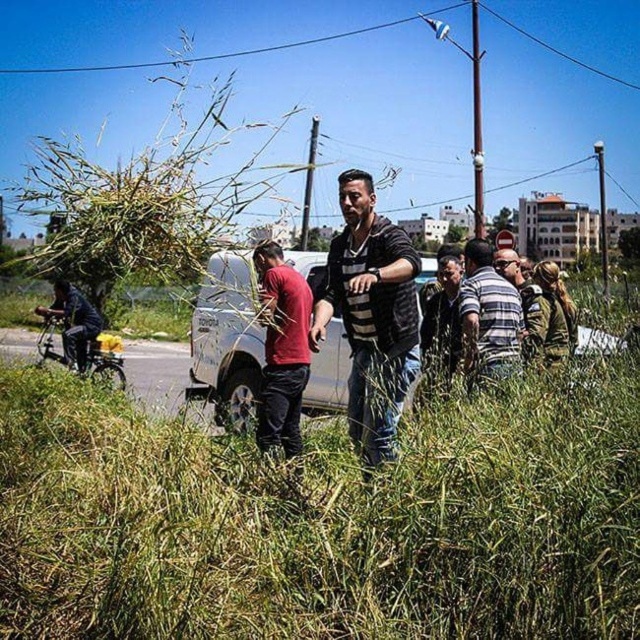
Question: Considering the real-world distances, which object is farthest from the striped sweater at center?

Choices:
 (A) striped fabric shirt at center
 (B) dark gray fabric bicycle at left
 (C) green grass at center
 (D) dark gray striped shirt at center

Answer: (B)

Question: Can you confirm if striped fabric shirt at center is positioned to the right of dark gray striped shirt at center?

Choices:
 (A) no
 (B) yes

Answer: (B)

Question: From the image, what is the correct spatial relationship of striped sweater at center in relation to dark gray fabric bicycle at left?

Choices:
 (A) left
 (B) right

Answer: (B)

Question: Which point is closer to the camera?

Choices:
 (A) (611, 385)
 (B) (429, 364)
 (C) (292, 426)

Answer: (A)

Question: Is green grass at center further to camera compared to white matte van at center?

Choices:
 (A) no
 (B) yes

Answer: (A)

Question: Which of these objects is positioned farthest from the green grass at center?

Choices:
 (A) striped fabric shirt at center
 (B) white matte van at center
 (C) dark gray striped shirt at center
 (D) green grass at left

Answer: (D)